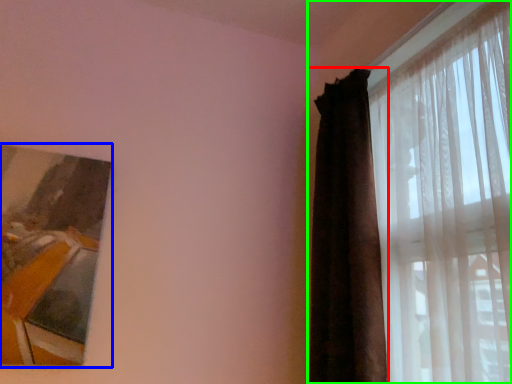
Question: Which is nearer to the curtain (highlighted by a red box)? picture frame (highlighted by a blue box) or curtain (highlighted by a green box).

Choices:
 (A) picture frame
 (B) curtain

Answer: (B)